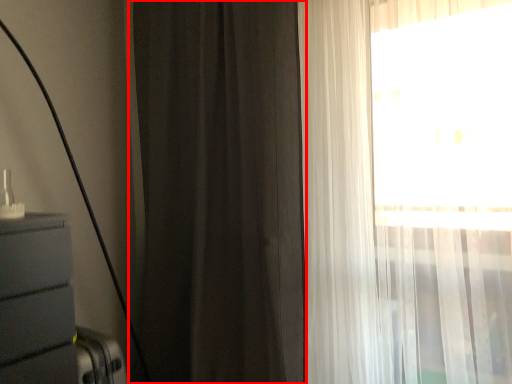
Question: From the image's perspective, what is the correct spatial positioning of curtain (annotated by the red box) in reference to curtain?

Choices:
 (A) above
 (B) below

Answer: (A)